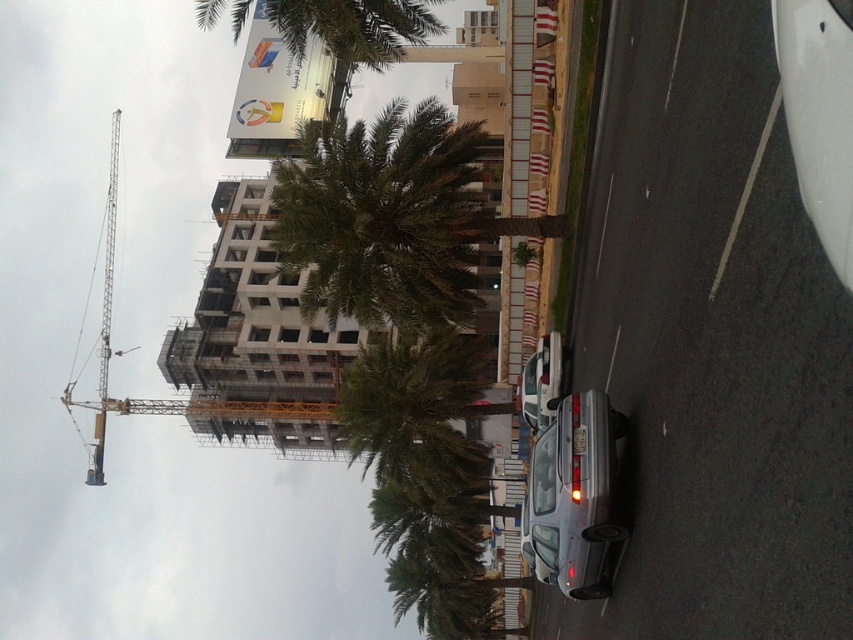
Question: Which point is farther to the camera?

Choices:
 (A) (351, 48)
 (B) (595, 531)
 (C) (334, 157)
 (D) (535, 630)

Answer: (D)

Question: Can you confirm if silver metallic car at center is positioned above satin silver sedan at center?

Choices:
 (A) yes
 (B) no

Answer: (B)

Question: Can you confirm if green leafy palm tree at upper center is thinner than satin silver sedan at center?

Choices:
 (A) yes
 (B) no

Answer: (B)

Question: Which object is farther from the camera taking this photo?

Choices:
 (A) green leafy palm tree at upper center
 (B) silver metallic car at center

Answer: (A)

Question: Is green leafy palm tree at center further to camera compared to satin silver sedan at center?

Choices:
 (A) no
 (B) yes

Answer: (A)

Question: Among these points, which one is nearest to the camera?

Choices:
 (A) (595, 500)
 (B) (368, 417)

Answer: (A)